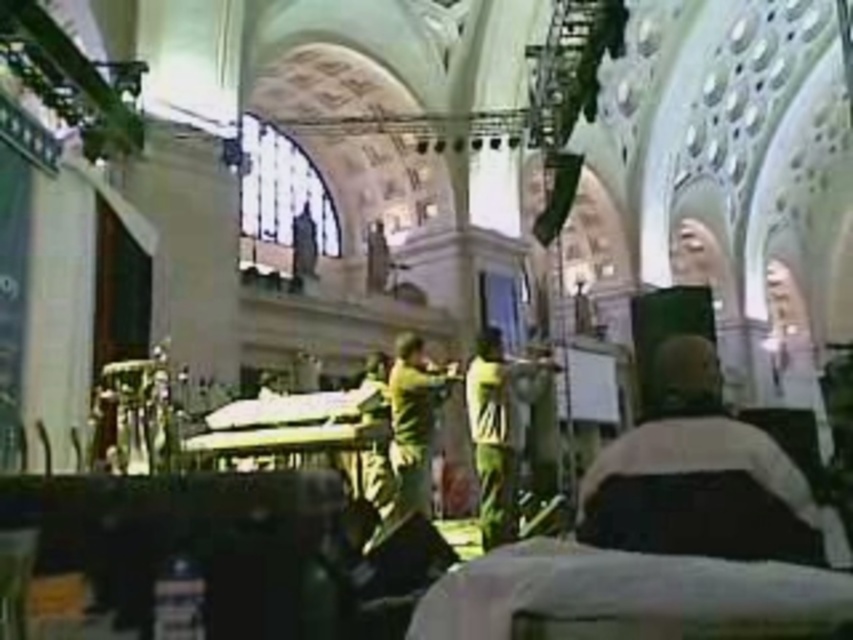
Find the location of `green fabric shirt at center`. green fabric shirt at center is located at coordinates (491, 436).

Does green fabric shirt at center come behind green matte shirt at center?

Yes, it is.

Is point (503, 452) more distant than point (403, 355)?

That is True.

You are a GUI agent. You are given a task and a screenshot of the screen. Output one action in this format:
    pyautogui.click(x=<x>, y=<y>)
    Task: Click on the green fabric shirt at center
    This screenshot has height=640, width=853.
    Given the screenshot: What is the action you would take?
    pyautogui.click(x=491, y=436)

Who is higher up, dark gray fabric jacket at center or green matte shirt at center?

dark gray fabric jacket at center is higher up.

Identify the location of dark gray fabric jacket at center. The height and width of the screenshot is (640, 853). (x=697, y=474).

Which is in front, point (589, 509) or point (428, 404)?

Point (589, 509)

Image resolution: width=853 pixels, height=640 pixels. In order to click on dark gray fabric jacket at center in this screenshot , I will do `click(697, 474)`.

Is dark gray fabric jacket at center below green fabric shirt at center?

No, dark gray fabric jacket at center is not below green fabric shirt at center.

Consider the image. Is dark gray fabric jacket at center thinner than green fabric shirt at center?

In fact, dark gray fabric jacket at center might be wider than green fabric shirt at center.

Who is more forward, (787,497) or (485,435)?

Point (787,497)

Where is `dark gray fabric jacket at center`? dark gray fabric jacket at center is located at coordinates (697, 474).